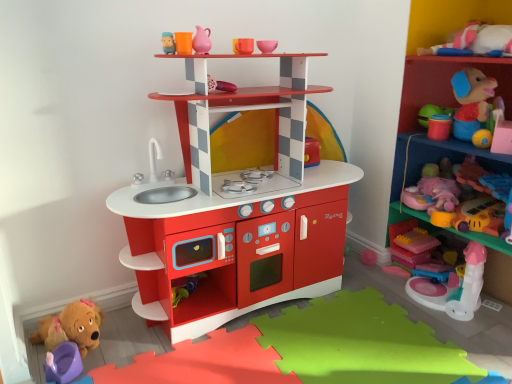
Find the location of `vacant area located to the right-hand side of purple plastic potty at lower left, acting as the 2th toy starting from the left`. vacant area located to the right-hand side of purple plastic potty at lower left, acting as the 2th toy starting from the left is located at coordinates (117, 362).